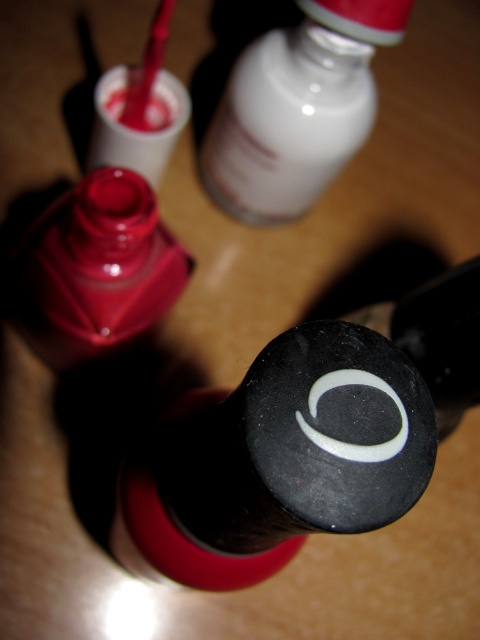
Question: Which object is farther from the camera taking this photo?

Choices:
 (A) matte red nail polish at center
 (B) white glossy bottle at upper center

Answer: (B)

Question: Can you confirm if white glossy bottle at upper center is wider than matte red nail polish at center?

Choices:
 (A) no
 (B) yes

Answer: (B)

Question: Which point is farther from the camera taking this photo?

Choices:
 (A) (127, 205)
 (B) (340, 8)

Answer: (B)

Question: Which point is farther to the camera?

Choices:
 (A) (279, 140)
 (B) (105, 208)

Answer: (A)

Question: Where is white glossy bottle at upper center located in relation to matte red nail polish at center in the image?

Choices:
 (A) right
 (B) left

Answer: (A)

Question: In this image, where is white glossy bottle at upper center located relative to matte red nail polish at center?

Choices:
 (A) left
 (B) right

Answer: (B)